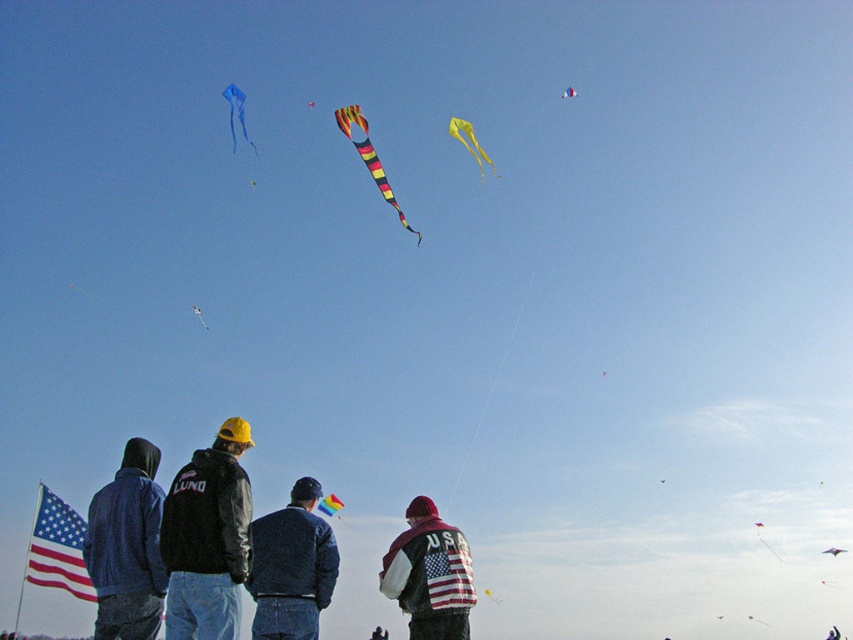
Is point (234, 152) less distant than point (310, 104)?

No.

Is blue fabric kite at upper left below yellow striped kite at upper center?

Yes, blue fabric kite at upper left is below yellow striped kite at upper center.

In order to click on blue fabric kite at upper left in this screenshot , I will do `click(236, 115)`.

Does yellow fabric kite at upper center appear on the right side of yellow striped kite at upper center?

Indeed, yellow fabric kite at upper center is positioned on the right side of yellow striped kite at upper center.

Does yellow fabric kite at upper center have a larger size compared to yellow striped kite at upper center?

Indeed, yellow fabric kite at upper center has a larger size compared to yellow striped kite at upper center.

Does point (469, 148) lie behind point (310, 106)?

No.

Locate an element on the screen. yellow fabric kite at upper center is located at coordinates (469, 144).

Who is more distant from viewer, (569,97) or (310,100)?

Positioned behind is point (569,97).

Does blue and white striped kite at upper center appear under yellow striped kite at upper center?

Incorrect, blue and white striped kite at upper center is not positioned below yellow striped kite at upper center.

Where is `blue and white striped kite at upper center`? Image resolution: width=853 pixels, height=640 pixels. blue and white striped kite at upper center is located at coordinates (569, 92).